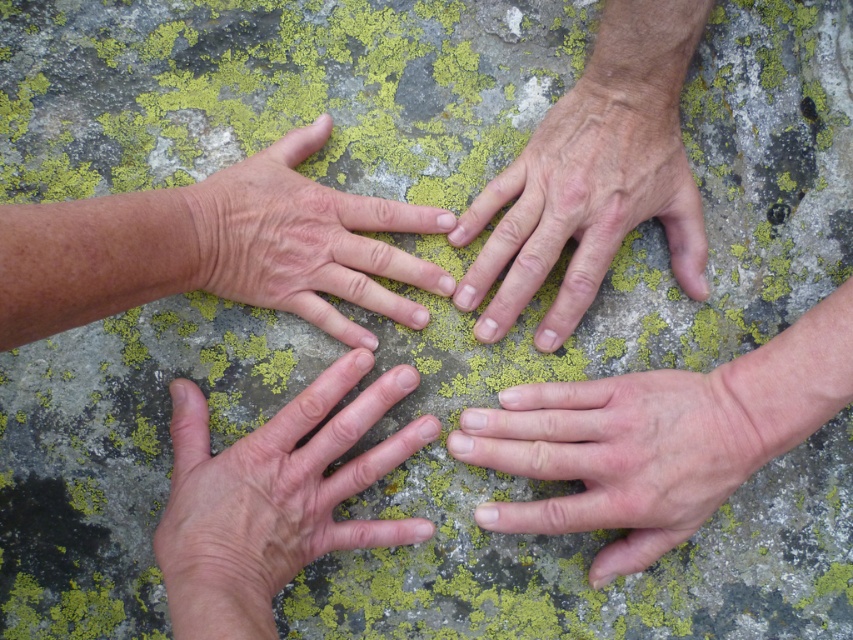
Between dry skin hand at lower left and dry skin hand at center, which one appears on the right side from the viewer's perspective?

dry skin hand at center

Is point (331, 522) positioned before point (276, 179)?

That is True.

Between point (206, 634) and point (412, 282), which one is positioned behind?

Positioned behind is point (412, 282).

In order to click on dry skin hand at lower left in this screenshot , I will do `click(274, 497)`.

Can you confirm if pale skin hand at lower right is positioned to the left of dry skin hand at upper center?

No, pale skin hand at lower right is not to the left of dry skin hand at upper center.

Does pale skin hand at lower right appear under dry skin hand at upper center?

Yes.

Does point (515, 394) lie in front of point (531, 195)?

Yes, point (515, 394) is closer to viewer.

I want to click on pale skin hand at lower right, so click(x=622, y=454).

Measure the distance from dry skin hand at lower left to pale skin hand at lower right.

They are 6.79 inches apart.

Does dry skin hand at lower left appear on the left side of pale skin hand at lower right?

Yes, dry skin hand at lower left is to the left of pale skin hand at lower right.

Where is `dry skin hand at lower left`? dry skin hand at lower left is located at coordinates (274, 497).